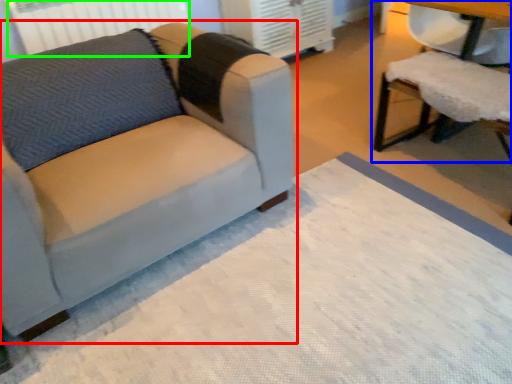
Question: Based on their relative distances, which object is farther from studio couch (highlighted by a red box)? Choose from chair (highlighted by a blue box) and radiator (highlighted by a green box).

Choices:
 (A) chair
 (B) radiator

Answer: (B)